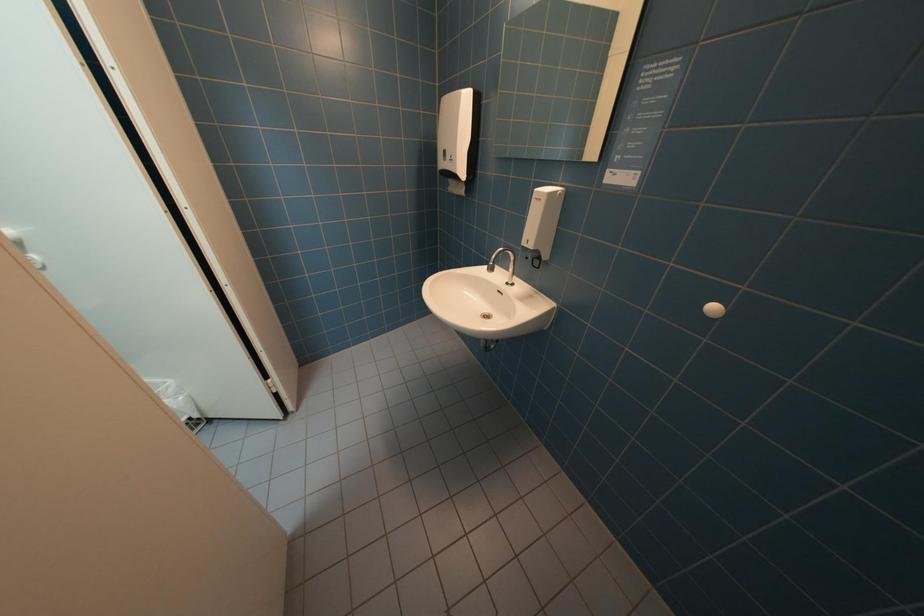
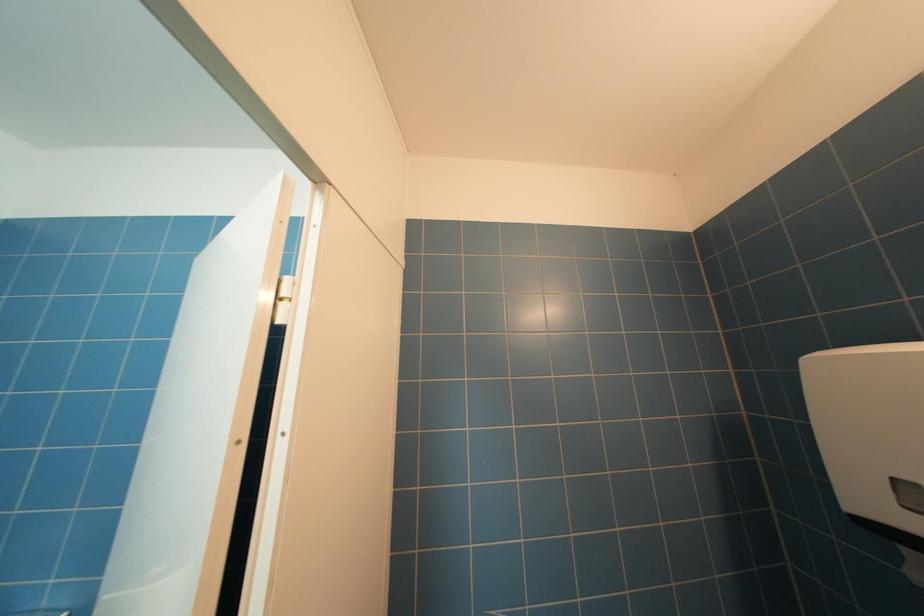
The first image is from the beginning of the video and the second image is from the end. How did the camera likely rotate when shooting the video?

The camera rotated toward left-up.